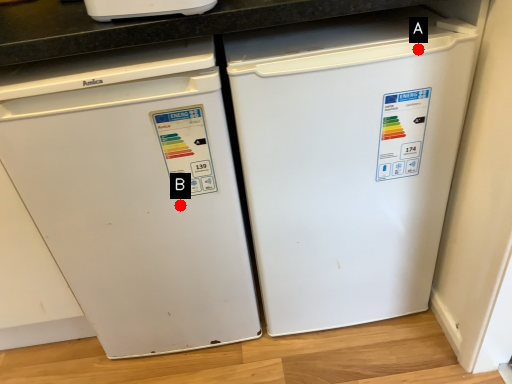
Question: Two points are circled on the image, labeled by A and B beside each circle. Which point appears closest to the camera in this image?

Choices:
 (A) A is closer
 (B) B is closer

Answer: (A)